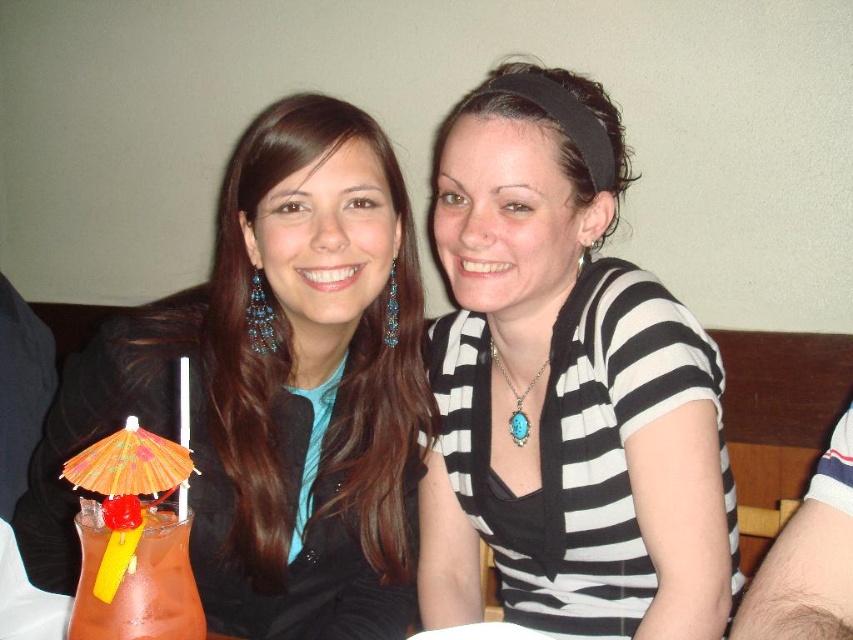
Question: Among these points, which one is farthest from the camera?

Choices:
 (A) (x=546, y=564)
 (B) (x=152, y=580)

Answer: (A)

Question: Which of the following is the closest to the observer?

Choices:
 (A) (181, 592)
 (B) (554, 490)

Answer: (A)

Question: Which object is positioned farthest from the matte orange drink at lower left?

Choices:
 (A) black striped shirt at center
 (B) matte black jacket at left

Answer: (A)

Question: From the image, what is the correct spatial relationship of black striped shirt at center in relation to matte orange drink at lower left?

Choices:
 (A) above
 (B) below

Answer: (A)

Question: Does black striped shirt at center appear on the right side of matte orange drink at lower left?

Choices:
 (A) no
 (B) yes

Answer: (B)

Question: Can you confirm if black striped shirt at center is smaller than matte black jacket at left?

Choices:
 (A) yes
 (B) no

Answer: (B)